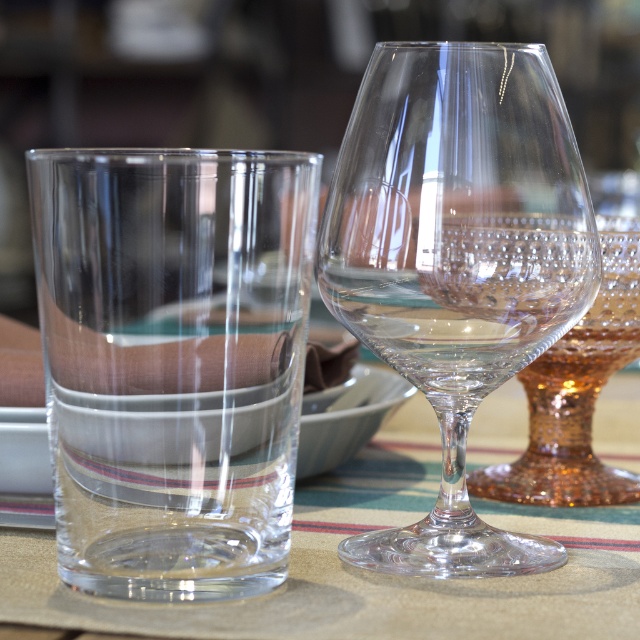
Which is in front, point (192, 236) or point (480, 636)?

Positioned in front is point (192, 236).

Between transparent glass at left and clear fabric placemat at center, which one appears on the left side from the viewer's perspective?

Positioned to the left is transparent glass at left.

Between point (212, 356) and point (449, 616), which one is positioned in front?

Point (212, 356) is more forward.

Where is `transparent glass at left`? This screenshot has height=640, width=640. transparent glass at left is located at coordinates (173, 362).

Does transparent glass at left come in front of clear crystal wine glass at center?

Yes, it is in front of clear crystal wine glass at center.

Who is positioned more to the left, transparent glass at left or clear crystal wine glass at center?

Positioned to the left is transparent glass at left.

Is point (106, 529) farther from camera compared to point (456, 394)?

No, it is not.

Locate an element on the screen. transparent glass at left is located at coordinates (173, 362).

Between clear crystal wine glass at center and clear fabric placemat at center, which one is positioned higher?

clear crystal wine glass at center is above.

Who is more forward, (456,396) or (358,612)?

Point (358,612) is in front.

The image size is (640, 640). Find the location of `clear crystal wine glass at center`. clear crystal wine glass at center is located at coordinates (456, 260).